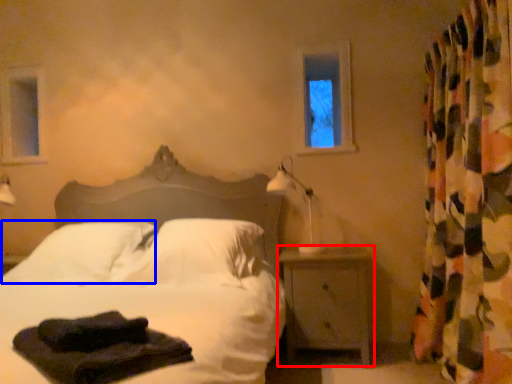
Question: Which object appears farthest to the camera in this image, nightstand (highlighted by a red box) or pillow (highlighted by a blue box)?

Choices:
 (A) nightstand
 (B) pillow

Answer: (A)